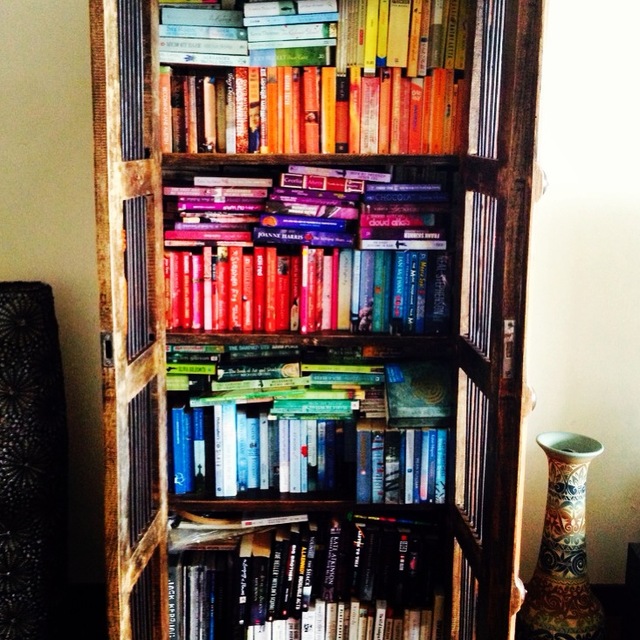
The height and width of the screenshot is (640, 640). I want to click on locks, so click(x=509, y=326), click(x=506, y=358), click(x=109, y=346).